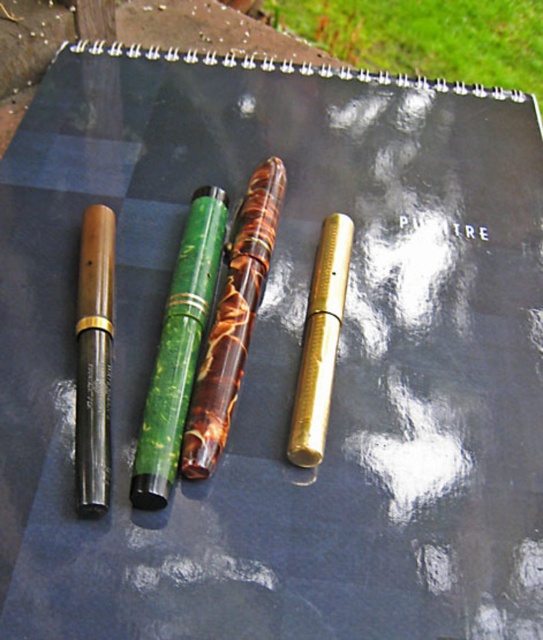
Which is more to the left, green marble pen at center or wooden pen at left?

wooden pen at left

Is point (188, 285) in front of point (91, 324)?

No, (188, 285) is further to viewer.

The image size is (543, 640). What are the coordinates of `green marble pen at center` in the screenshot? It's located at (179, 349).

Is marbled brown pen at center to the left of wooden pen at left from the viewer's perspective?

Incorrect, marbled brown pen at center is not on the left side of wooden pen at left.

Between marbled brown pen at center and wooden pen at left, which one has less height?

wooden pen at left

The width and height of the screenshot is (543, 640). What are the coordinates of `marbled brown pen at center` in the screenshot? It's located at (232, 321).

Where is `marbled brown pen at center`? Image resolution: width=543 pixels, height=640 pixels. marbled brown pen at center is located at coordinates (232, 321).

Is green marble pen at center behind marbled brown pen at center?

No, it is not.

Who is positioned more to the left, green marble pen at center or marbled brown pen at center?

green marble pen at center is more to the left.

Is point (190, 326) farther from camera compared to point (260, 180)?

No, (190, 326) is in front of (260, 180).

Locate an element on the screen. Image resolution: width=543 pixels, height=640 pixels. green marble pen at center is located at coordinates (179, 349).